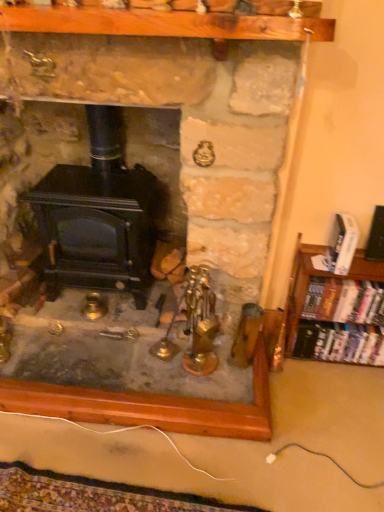
Question: From a real-world perspective, is hardcover books at right, which appears as the 2th book when ordered from the bottom, beneath hardcover books at right, which ranks as the third book in top-to-bottom order?

Choices:
 (A) yes
 (B) no

Answer: (B)

Question: Can we say hardcover books at right, the 2th book in the top-to-bottom sequence, lies outside hardcover books at right, the 1th book in the bottom-to-top sequence?

Choices:
 (A) yes
 (B) no

Answer: (A)

Question: Is hardcover books at right, which appears as the 2th book when ordered from the bottom, positioned in front of hardcover books at right, the 1th book in the bottom-to-top sequence?

Choices:
 (A) no
 (B) yes

Answer: (B)

Question: Is the position of hardcover books at right, which appears as the 2th book when ordered from the bottom, more distant than that of hardcover books at right, the 1th book in the bottom-to-top sequence?

Choices:
 (A) no
 (B) yes

Answer: (A)

Question: From the image's perspective, would you say hardcover books at right, which appears as the 2th book when ordered from the bottom, is shown under hardcover books at right, the 1th book in the bottom-to-top sequence?

Choices:
 (A) yes
 (B) no

Answer: (B)

Question: Is hardcover books at right, the 2th book in the top-to-bottom sequence, thinner than hardcover books at right, which ranks as the third book in top-to-bottom order?

Choices:
 (A) no
 (B) yes

Answer: (B)

Question: Does hardcover books at right, the 1th book in the bottom-to-top sequence, turn towards black matte wood burning stove at center?

Choices:
 (A) yes
 (B) no

Answer: (B)

Question: Considering the relative sizes of hardcover books at right, the 1th book in the bottom-to-top sequence, and black matte wood burning stove at center in the image provided, is hardcover books at right, the 1th book in the bottom-to-top sequence, shorter than black matte wood burning stove at center?

Choices:
 (A) yes
 (B) no

Answer: (A)

Question: Considering the relative sizes of hardcover books at right, the 1th book in the bottom-to-top sequence, and black matte wood burning stove at center in the image provided, is hardcover books at right, the 1th book in the bottom-to-top sequence, bigger than black matte wood burning stove at center?

Choices:
 (A) yes
 (B) no

Answer: (B)

Question: From a real-world perspective, is hardcover books at right, which ranks as the third book in top-to-bottom order, on top of black matte wood burning stove at center?

Choices:
 (A) no
 (B) yes

Answer: (A)

Question: Is hardcover books at right, which ranks as the third book in top-to-bottom order, at the left side of black matte wood burning stove at center?

Choices:
 (A) yes
 (B) no

Answer: (B)

Question: Can you confirm if hardcover books at right, the 1th book in the bottom-to-top sequence, is wider than black matte wood burning stove at center?

Choices:
 (A) yes
 (B) no

Answer: (B)

Question: Is white glossy book at right, the third book from the bottom, positioned with its back to hardcover books at right, which appears as the 2th book when ordered from the bottom?

Choices:
 (A) yes
 (B) no

Answer: (B)